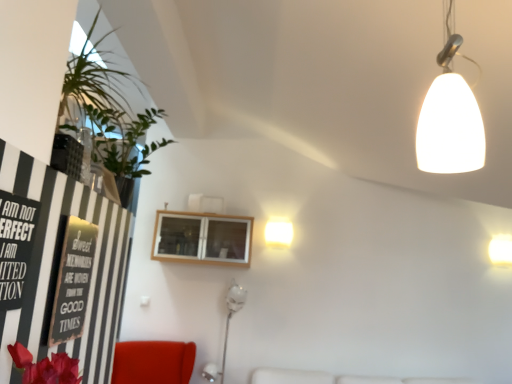
What do you see at coordinates (202, 238) in the screenshot? I see `wooden cabinet at upper center` at bounding box center [202, 238].

The width and height of the screenshot is (512, 384). In order to click on wooden cabinet at upper center in this screenshot , I will do `click(202, 238)`.

Find the location of `white glossy lampshade at upper right, which is counted as the third lamp, starting from the bottom`. white glossy lampshade at upper right, which is counted as the third lamp, starting from the bottom is located at coordinates (450, 122).

The image size is (512, 384). What do you see at coordinates (278, 233) in the screenshot?
I see `white glossy wall lamp at upper center, which ranks as the 1th lamp in left-to-right order` at bounding box center [278, 233].

At what (x,y) coordinates should I click in order to perform the action: click on white glossy wall sconce at upper right, the 3th lamp positioned from the left. Please return your answer as a coordinate pair (x, y). This screenshot has width=512, height=384. Looking at the image, I should click on (501, 250).

Measure the distance between point (10, 250) and camera.

They are 3.40 feet apart.

The width and height of the screenshot is (512, 384). I want to click on white glossy lamp at lower center, so click(226, 328).

Considering the sizes of objects black matte signboard at left and wooden cabinet at upper center in the image provided, who is thinner, black matte signboard at left or wooden cabinet at upper center?

black matte signboard at left.

Consider the image. Between black matte signboard at left and wooden cabinet at upper center, which one has more height?

With more height is wooden cabinet at upper center.

Can we say black matte signboard at left lies outside wooden cabinet at upper center?

Yes, black matte signboard at left is not within wooden cabinet at upper center.

Could you tell me if green leafy plant at upper left is turned towards black matte signboard at left?

No, green leafy plant at upper left does not turn towards black matte signboard at left.

Identify the location of bulletin board that is below the green leafy plant at upper left (from the image's perspective). (73, 281).

Between point (140, 169) and point (65, 291), which one is positioned in front?

Positioned in front is point (65, 291).

Is green leafy plant at upper left not inside black matte signboard at left?

Yes.

From a real-world perspective, between black paper poster at left and green leafy plant at upper left, who is vertically lower?

From a 3D spatial view, black paper poster at left is below.

Is black paper poster at left next to green leafy plant at upper left and touching it?

No, black paper poster at left is not beside green leafy plant at upper left.

Is green leafy plant at upper left located within black paper poster at left?

No, black paper poster at left does not contain green leafy plant at upper left.

Locate an element on the screen. The image size is (512, 384). poster page above the white glossy wall sconce at upper right, marked as the 2th lamp in a back-to-front arrangement (from the image's perspective) is located at coordinates (15, 246).

From a real-world perspective, is black paper poster at left positioned under white glossy wall sconce at upper right, marked as the 2th lamp in a back-to-front arrangement, based on gravity?

Yes, from a real-world perspective, black paper poster at left is under white glossy wall sconce at upper right, marked as the 2th lamp in a back-to-front arrangement.

Is black paper poster at left oriented towards white glossy wall sconce at upper right, marked as the 2th lamp in a back-to-front arrangement?

No, black paper poster at left does not turn towards white glossy wall sconce at upper right, marked as the 2th lamp in a back-to-front arrangement.

Considering the sizes of objects black paper poster at left and white glossy wall sconce at upper right, acting as the first lamp starting from the right, in the image provided, who is smaller, black paper poster at left or white glossy wall sconce at upper right, acting as the first lamp starting from the right,?

black paper poster at left is smaller.

Does velvet red armchair at lower left have a lesser height compared to black paper poster at left?

Incorrect, the height of velvet red armchair at lower left does not fall short of that of black paper poster at left.

Is velvet red armchair at lower left in contact with black paper poster at left?

No, velvet red armchair at lower left is not making contact with black paper poster at left.

What's the angular difference between velvet red armchair at lower left and black paper poster at left's facing directions?

The angular difference between velvet red armchair at lower left and black paper poster at left is 62.3 degrees.

Is velvet red armchair at lower left oriented towards black paper poster at left?

No, velvet red armchair at lower left is not turned towards black paper poster at left.

From a real-world perspective, does white glossy lamp at lower center stand above white glossy wall sconce at upper right, acting as the first lamp starting from the right?

No, from a real-world perspective, white glossy lamp at lower center is not on top of white glossy wall sconce at upper right, acting as the first lamp starting from the right.

Can you tell me how much white glossy lamp at lower center and white glossy wall sconce at upper right, marked as the 2th lamp in a back-to-front arrangement, differ in facing direction?

They differ by 0.876 degrees in their facing directions.

Which of these two, white glossy lamp at lower center or white glossy wall sconce at upper right, acting as the first lamp starting from the right, stands taller?

white glossy lamp at lower center.

Is white glossy lamp at lower center with white glossy wall sconce at upper right, the 1th lamp from the bottom?

white glossy lamp at lower center and white glossy wall sconce at upper right, the 1th lamp from the bottom, are clearly separated.

Is white glossy lampshade at upper right, positioned as the 3th lamp in back-to-front order, further to camera compared to green leafy plant at upper left?

No, white glossy lampshade at upper right, positioned as the 3th lamp in back-to-front order, is in front of green leafy plant at upper left.

Is point (460, 100) positioned after point (98, 12)?

No, (460, 100) is in front of (98, 12).

From a real-world perspective, who is located higher, white glossy lampshade at upper right, which appears as the 1th lamp when viewed from the front, or green leafy plant at upper left?

white glossy lampshade at upper right, which appears as the 1th lamp when viewed from the front, from a real-world perspective.

Based on the photo, is there a large distance between white glossy lampshade at upper right, which appears as the second lamp when viewed from the right, and green leafy plant at upper left?

That's right, there is a large distance between white glossy lampshade at upper right, which appears as the second lamp when viewed from the right, and green leafy plant at upper left.

Locate an element on the screen. bulletin board that is under the wooden cabinet at upper center (from a real-world perspective) is located at coordinates (73, 281).

You are a GUI agent. You are given a task and a screenshot of the screen. Output one action in this format:
    pyautogui.click(x=<x>, y=<y>)
    Task: Click on the houseplant above the black matte signboard at left (from the image's perspective)
    
    Given the screenshot: What is the action you would take?
    pyautogui.click(x=109, y=114)

From the picture: When comparing their distances from black paper poster at left, does velvet red armchair at lower left or white glossy wall sconce at upper right, the 3th lamp positioned from the top, seem closer?

Based on the image, velvet red armchair at lower left appears to be nearer to black paper poster at left.

Estimate the real-world distances between objects in this image. Which object is closer to black paper poster at left, green leafy plant at upper left or wooden cabinet at upper center?

green leafy plant at upper left is positioned closer to the anchor black paper poster at left.

When comparing their distances from black matte signboard at left, does green leafy plant at upper left or white glossy lampshade at upper right, positioned as the 3th lamp in back-to-front order, seem closer?

green leafy plant at upper left is positioned closer to the anchor black matte signboard at left.

Estimate the real-world distances between objects in this image. Which object is closer to green leafy plant at upper left, velvet red armchair at lower left or white glossy lamp at lower center?

velvet red armchair at lower left is positioned closer to the anchor green leafy plant at upper left.

When comparing their distances from velvet red armchair at lower left, does white glossy wall lamp at upper center, which ranks as the 1th lamp in left-to-right order, or black paper poster at left seem closer?

Among the two, white glossy wall lamp at upper center, which ranks as the 1th lamp in left-to-right order, is located nearer to velvet red armchair at lower left.

Estimate the real-world distances between objects in this image. Which object is further from black paper poster at left, wooden cabinet at upper center or white glossy wall lamp at upper center, positioned as the third lamp in front-to-back order?

Based on the image, white glossy wall lamp at upper center, positioned as the third lamp in front-to-back order, appears to be further to black paper poster at left.

Considering their positions, is white glossy wall lamp at upper center, which ranks as the first lamp in back-to-front order, positioned closer to white glossy lamp at lower center than white glossy wall sconce at upper right, acting as the first lamp starting from the right?

white glossy wall lamp at upper center, which ranks as the first lamp in back-to-front order, is positioned closer to the anchor white glossy lamp at lower center.

Estimate the real-world distances between objects in this image. Which object is further from green leafy plant at upper left, white glossy wall sconce at upper right, the 2th lamp when ordered from front to back, or white glossy lampshade at upper right, which appears as the second lamp when viewed from the right?

white glossy wall sconce at upper right, the 2th lamp when ordered from front to back, is positioned further to the anchor green leafy plant at upper left.

At what (x,y) coordinates should I click in order to perform the action: click on bulletin board between black paper poster at left and velvet red armchair at lower left from front to back. Please return your answer as a coordinate pair (x, y). Looking at the image, I should click on (73, 281).

At what (x,y) coordinates should I click in order to perform the action: click on bulletin board positioned between black paper poster at left and wooden cabinet at upper center from near to far. Please return your answer as a coordinate pair (x, y). Image resolution: width=512 pixels, height=384 pixels. Looking at the image, I should click on (73, 281).

Identify the location of bulletin board positioned between black paper poster at left and green leafy plant at upper left from near to far. (73, 281).

Find the location of a particular element. Image resolution: width=512 pixels, height=384 pixels. lamp between black paper poster at left and white glossy lamp at lower center from front to back is located at coordinates (450, 122).